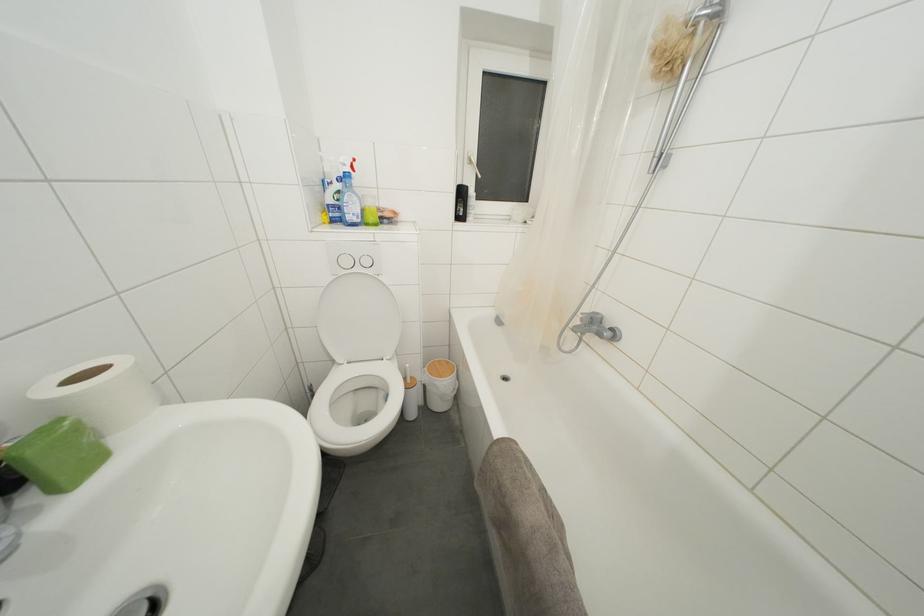
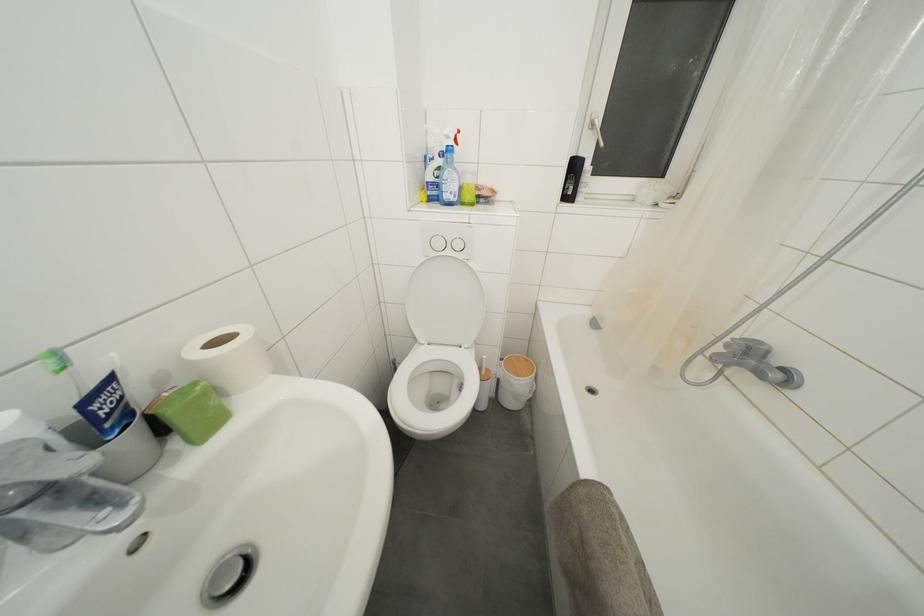
Where in the second image is the point corresponding to pixel 475 167 from the first image?

(597, 131)